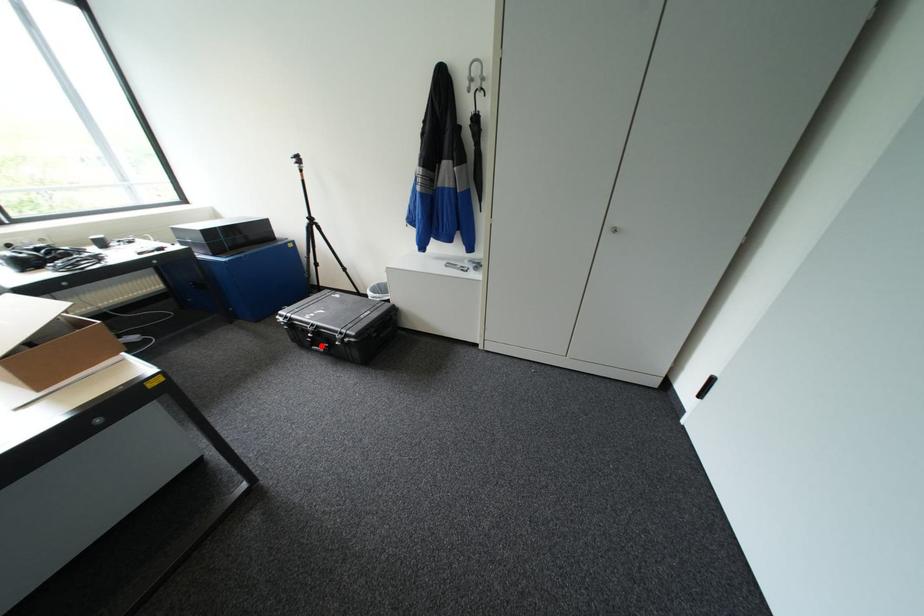
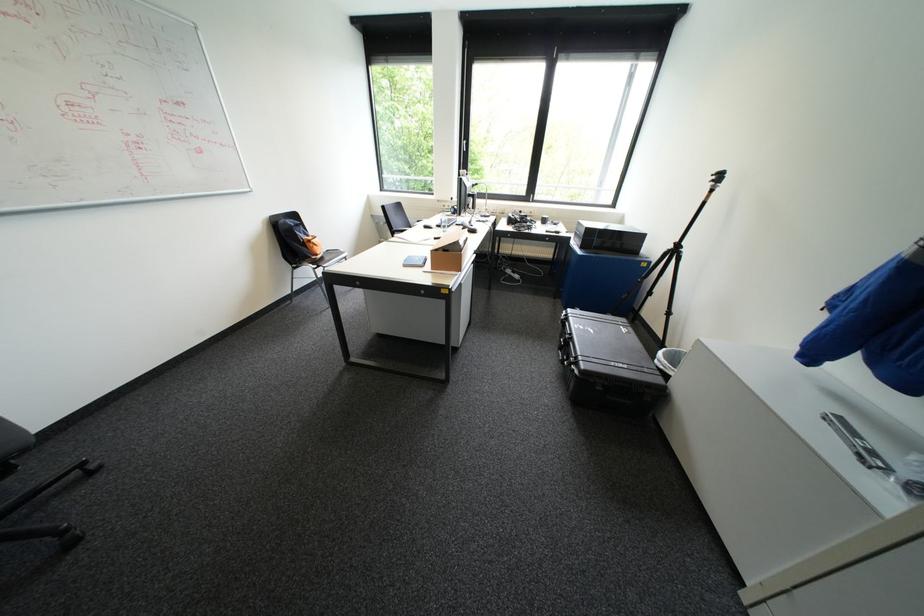
Locate, in the second image, the point that corresponds to the highlighted location in the first image.

(567, 350)